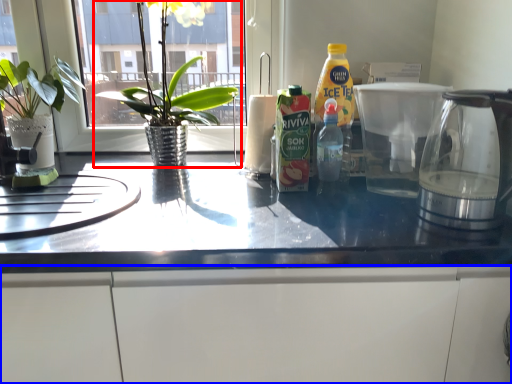
Question: Among these objects, which one is nearest to the camera, houseplant (highlighted by a red box) or cabinetry (highlighted by a blue box)?

Choices:
 (A) houseplant
 (B) cabinetry

Answer: (B)